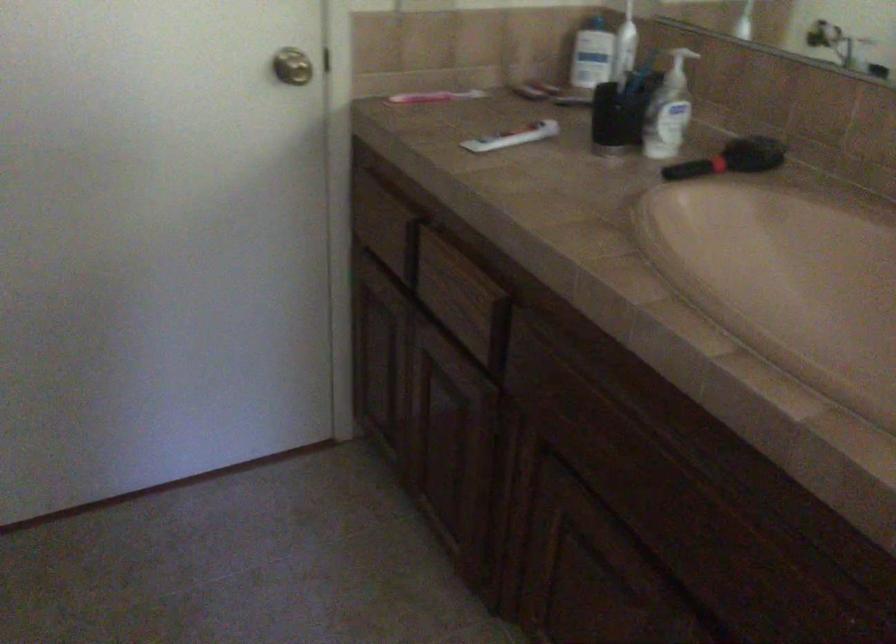
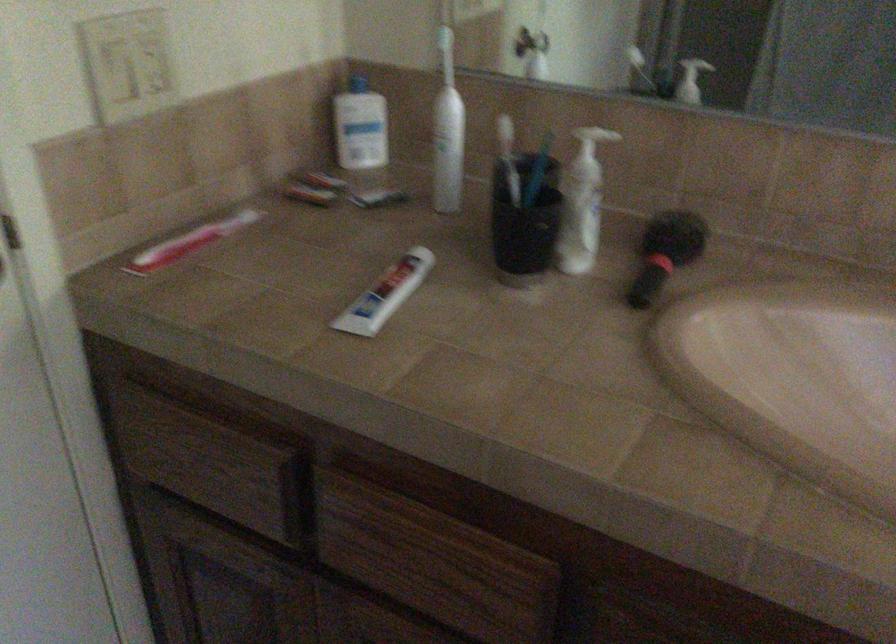
Where in the second image is the point corresponding to point (604, 102) from the first image?

(524, 222)